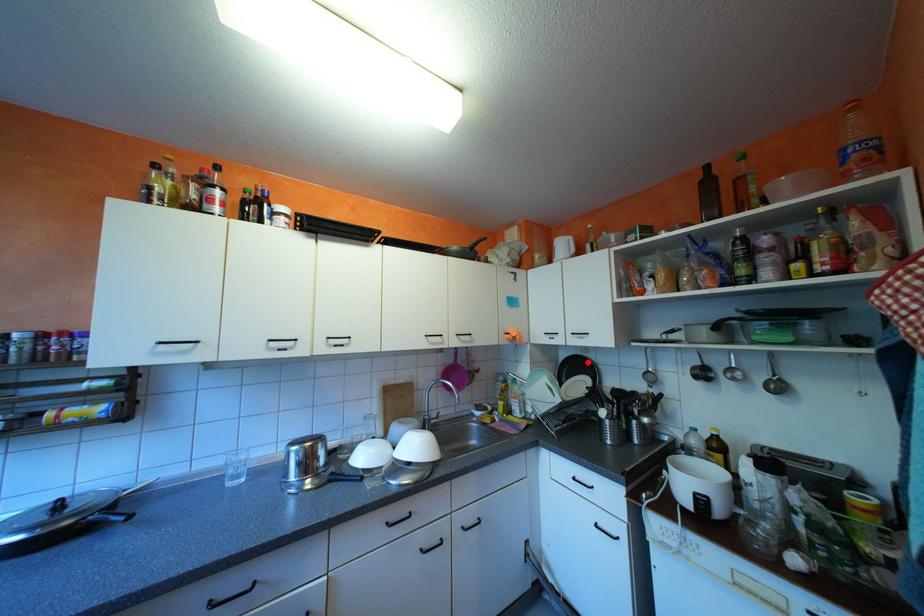
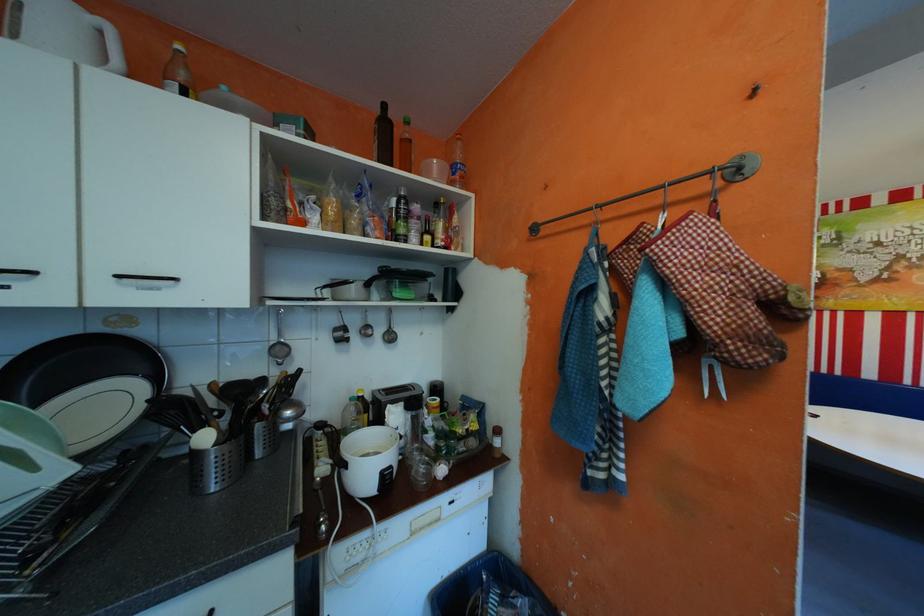
In the second image, find the point that corresponds to the highlighted location in the first image.

(105, 353)